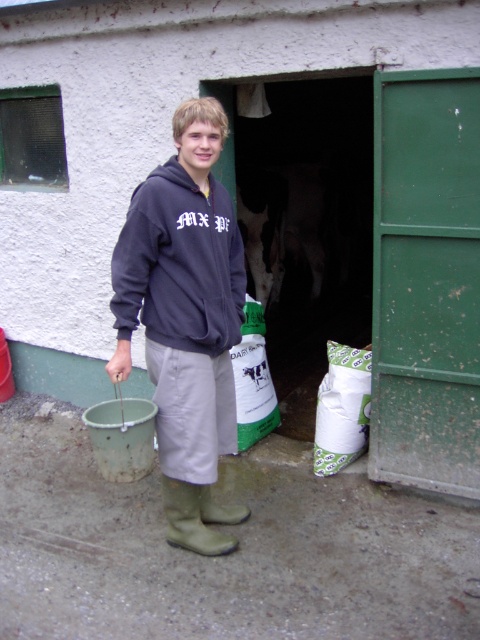
Question: Is matte gray hoodie at center to the right of dark gray fleece sweatshirt at center from the viewer's perspective?

Choices:
 (A) yes
 (B) no

Answer: (B)

Question: Which object is farther from the camera taking this photo?

Choices:
 (A) matte gray hoodie at center
 (B) green rubber boot at lower center

Answer: (B)

Question: Does matte gray hoodie at center appear on the left side of dark gray fleece sweatshirt at center?

Choices:
 (A) yes
 (B) no

Answer: (A)

Question: Which point is closer to the camera taking this photo?

Choices:
 (A) (173, 268)
 (B) (188, 547)
 (C) (194, 108)

Answer: (C)

Question: Estimate the real-world distances between objects in this image. Which object is farther from the matte gray hoodie at center?

Choices:
 (A) dark gray fleece sweatshirt at center
 (B) green rubber boot at lower center

Answer: (B)

Question: Is matte gray hoodie at center further to the viewer compared to green rubber boot at lower center?

Choices:
 (A) no
 (B) yes

Answer: (A)